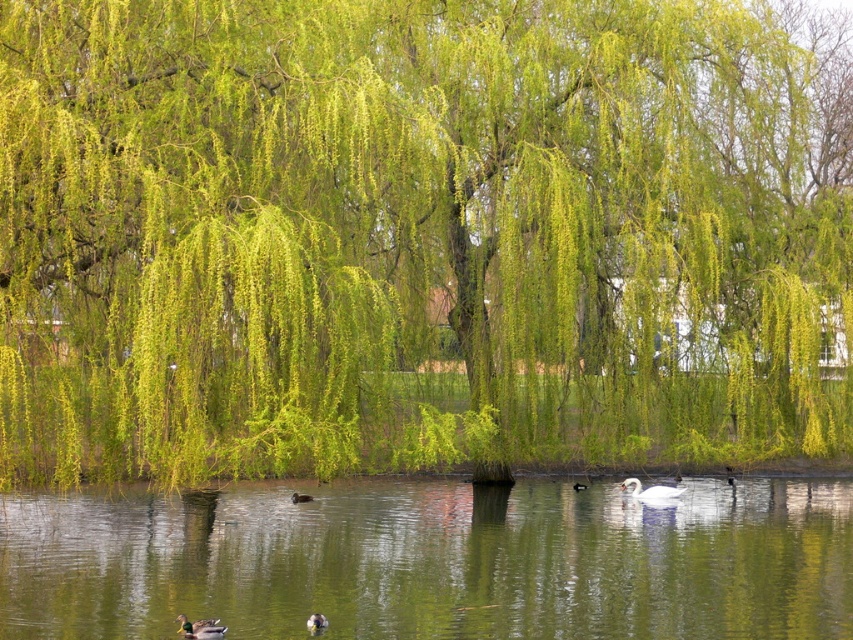
Question: Is brown matte duck at lower center thinner than white matte duck at center?

Choices:
 (A) no
 (B) yes

Answer: (A)

Question: Does green reflective water at center appear on the right side of brown matte duck at lower center?

Choices:
 (A) no
 (B) yes

Answer: (B)

Question: Is green reflective water at center smaller than brown fuzzy duck at lower center?

Choices:
 (A) no
 (B) yes

Answer: (A)

Question: Which point appears closest to the camera in this image?

Choices:
 (A) (15, 520)
 (B) (577, 488)

Answer: (A)

Question: Which object is farther from the camera taking this photo?

Choices:
 (A) green reflective water at center
 (B) brown fuzzy duck at lower center
 (C) white glossy goose at center

Answer: (C)

Question: Which object appears closest to the camera in this image?

Choices:
 (A) white matte duck at center
 (B) white glossy goose at center
 (C) brown matte duck at lower center
 (D) green matte duck at lower left

Answer: (D)